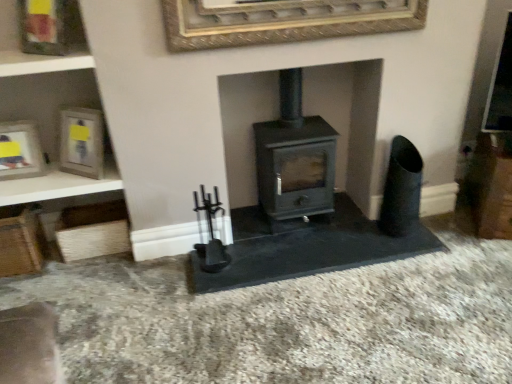
The width and height of the screenshot is (512, 384). In order to click on vacant space underneath gold textured picture frame at upper center, acting as the first picture frame starting from the right (from a real-world perspective) in this screenshot , I will do `click(298, 235)`.